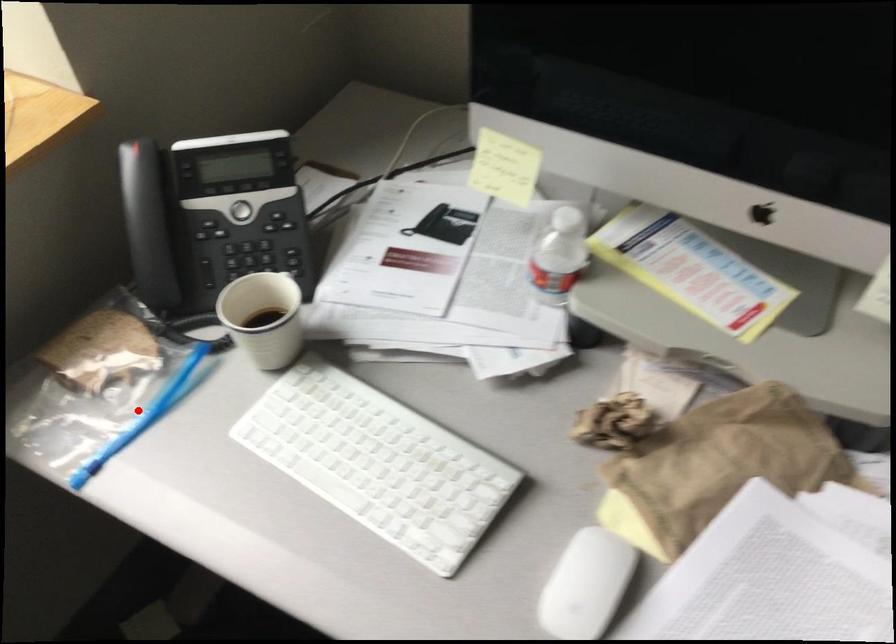
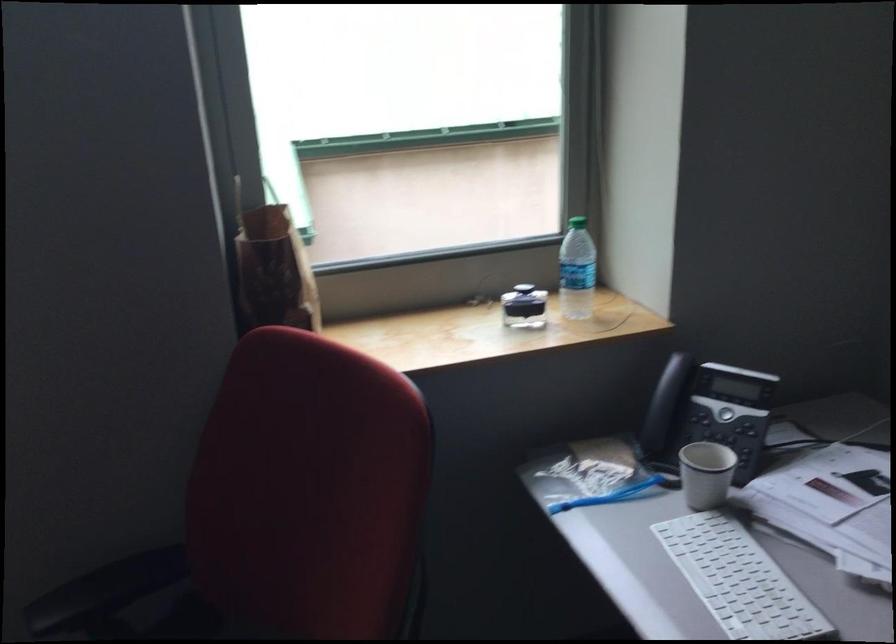
Question: I am providing you with two images of the same scene from different viewpoints. Image1 has a red point marked. In image2, the corresponding 3D location appears at what relative position? Reply with the corresponding letter.

Choices:
 (A) Closer
 (B) Farther

Answer: (B)